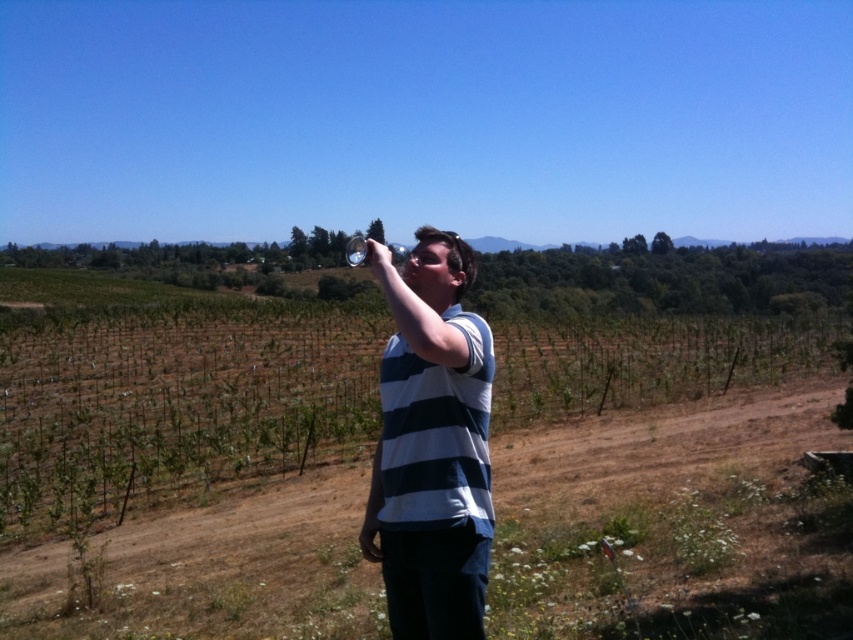
Between white striped shirt at center and clear glass at upper center, which one has less height?

white striped shirt at center is shorter.

Which is behind, point (461, 240) or point (399, 244)?

The point (399, 244) is behind.

Where is `white striped shirt at center`? This screenshot has width=853, height=640. white striped shirt at center is located at coordinates (432, 445).